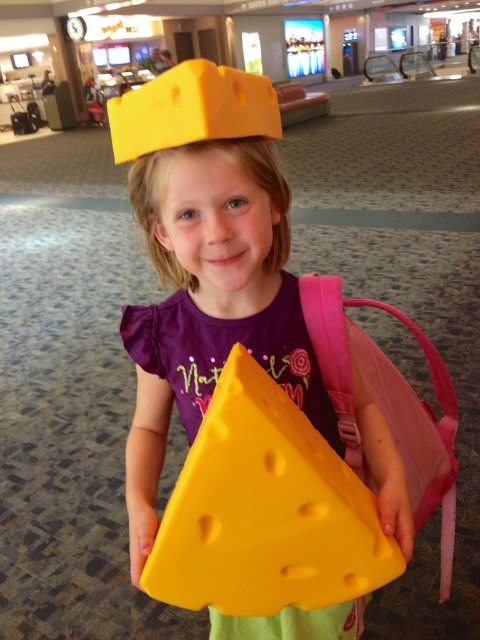
Is yellow matte cheese at center further to the viewer compared to yellow rubbery cheese at center?

Yes, yellow matte cheese at center is further from the viewer.

Which of these two, yellow matte cheese at center or yellow rubbery cheese at center, stands taller?

yellow matte cheese at center is taller.

Does point (170, 358) lie in front of point (242, 419)?

No, it is not.

Locate an element on the screen. yellow matte cheese at center is located at coordinates (206, 262).

Identify the location of yellow matte cheese at center. Image resolution: width=480 pixels, height=640 pixels. (206, 262).

Is yellow matte cheese at center shorter than matte yellow cheese at center?

No, yellow matte cheese at center is not shorter than matte yellow cheese at center.

Who is more forward, (169, 378) or (275, 241)?

Point (275, 241)

At what (x,y) coordinates should I click in order to perform the action: click on yellow matte cheese at center. Please return your answer as a coordinate pair (x, y). The width and height of the screenshot is (480, 640). Looking at the image, I should click on (206, 262).

Can you confirm if yellow rubbery cheese at center is taller than matte yellow cheese at center?

Correct, yellow rubbery cheese at center is much taller as matte yellow cheese at center.

Measure the distance between yellow rubbery cheese at center and matte yellow cheese at center.

A distance of 12.20 inches exists between yellow rubbery cheese at center and matte yellow cheese at center.

Is point (334, 458) closer to camera compared to point (271, 186)?

Yes, it is in front of point (271, 186).

Find the location of a particular element. The width and height of the screenshot is (480, 640). yellow rubbery cheese at center is located at coordinates (265, 509).